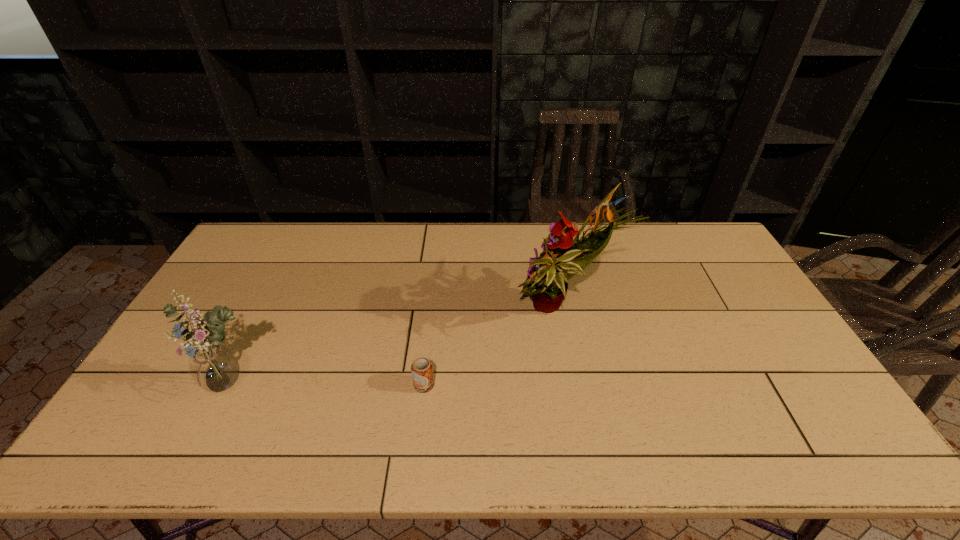
Where is `the farthest object`? The height and width of the screenshot is (540, 960). the farthest object is located at coordinates (563, 257).

The height and width of the screenshot is (540, 960). I want to click on the farther bouquet, so click(x=563, y=257).

Locate an element on the screen. Image resolution: width=960 pixels, height=540 pixels. the nearer bouquet is located at coordinates (214, 368).

You are a GUI agent. You are given a task and a screenshot of the screen. Output one action in this format:
    pyautogui.click(x=<x>, y=<y>)
    Task: Click on the left bouquet
    The width and height of the screenshot is (960, 540).
    Given the screenshot: What is the action you would take?
    pyautogui.click(x=214, y=368)

Locate an element on the screen. This screenshot has width=960, height=540. the second object from right to left is located at coordinates (422, 369).

Locate an element on the screen. the shortest object is located at coordinates (422, 369).

This screenshot has height=540, width=960. I want to click on free space located 0.220m on the front-facing side of the farthest object, so click(x=436, y=313).

The width and height of the screenshot is (960, 540). I want to click on free location located 0.140m on the front-facing side of the farthest object, so click(x=462, y=313).

At what (x,y) coordinates should I click in order to perform the action: click on vacant space located on the front-facing side of the farthest object. Please return your answer as a coordinate pair (x, y). Looking at the image, I should click on (393, 313).

Where is `vacant space located 0.140m on the front-facing side of the nearer bouquet`? This screenshot has width=960, height=540. vacant space located 0.140m on the front-facing side of the nearer bouquet is located at coordinates (195, 460).